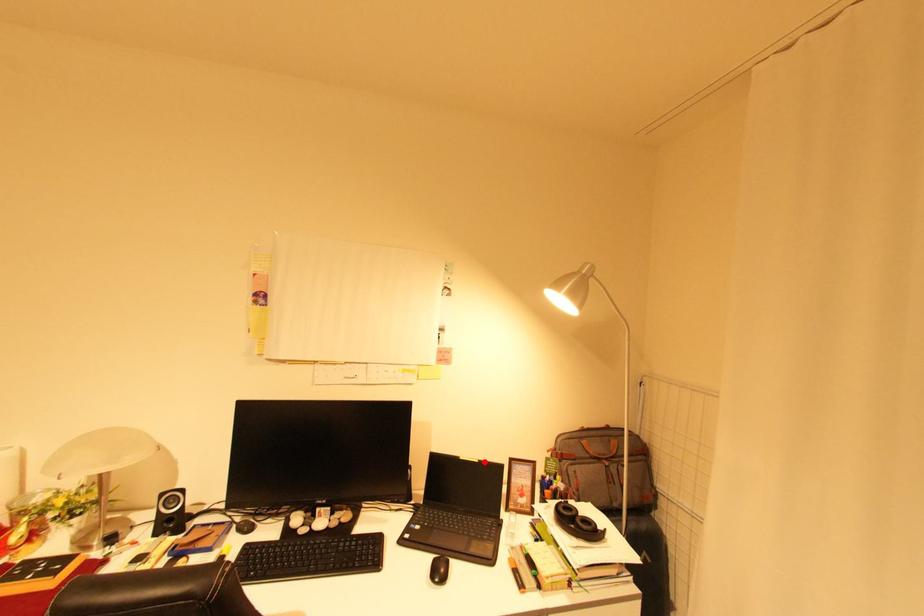
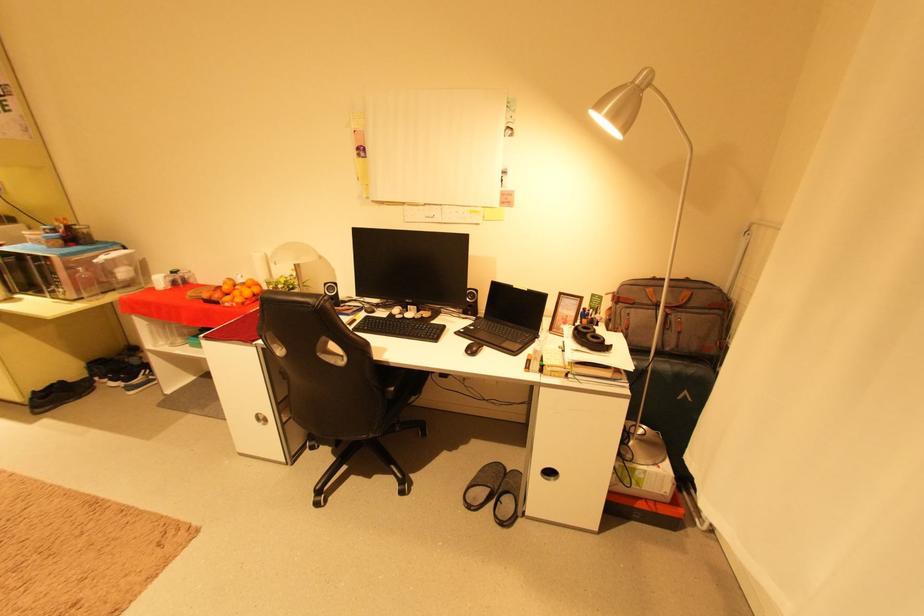
Question: I am providing you with two images of the same scene from different viewpoints. A red point is marked on the first image. At the location where the point appears in image 1, is it still visible in image 2?

Choices:
 (A) Yes
 (B) No

Answer: (A)